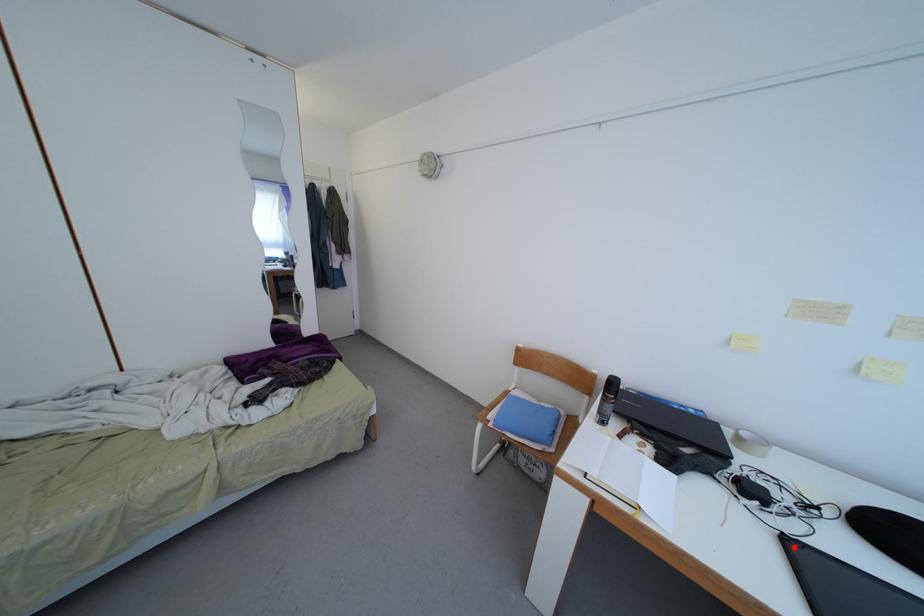
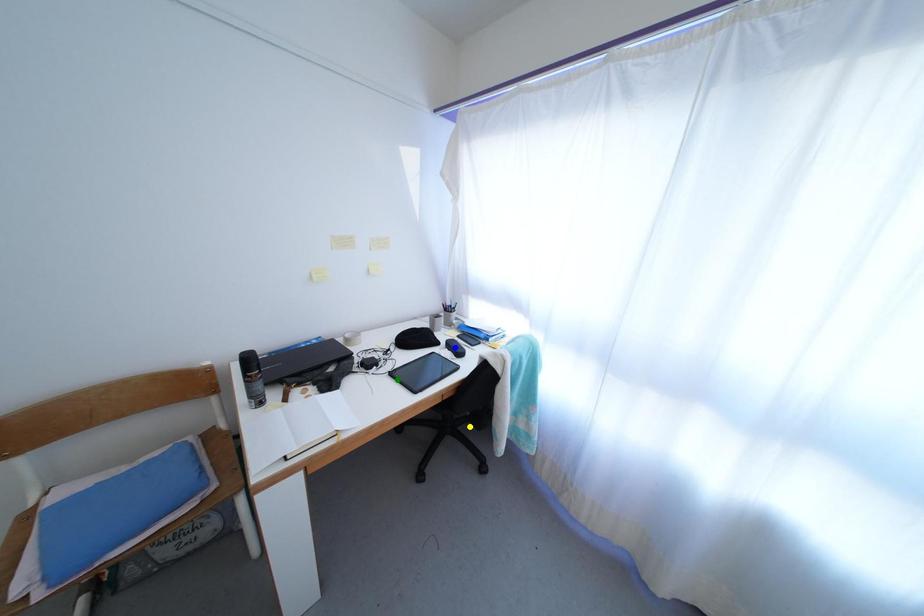
Question: I am providing you with two images of the same scene from different viewpoints. A red point is marked on the first image. You are given multiple points on the second image. Which mark in image 2 goes with the point in image 1?

Choices:
 (A) yellow point
 (B) green point
 (C) blue point

Answer: (B)